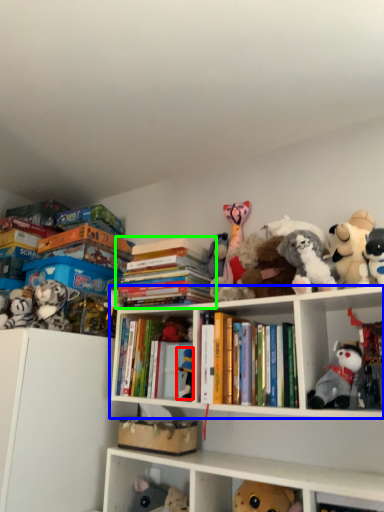
Question: Which object is the farthest from toy (highlighted by a red box)? Choose among these: cabinet (highlighted by a blue box) or book (highlighted by a green box).

Choices:
 (A) cabinet
 (B) book

Answer: (B)